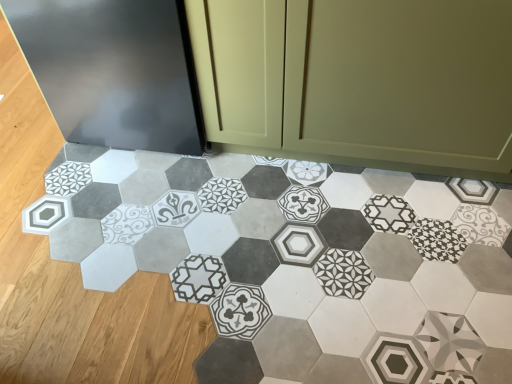
What is the approximate width of patterned ceramic tile at center?

The width of patterned ceramic tile at center is 3.71 feet.

What do you see at coordinates (296, 261) in the screenshot? The image size is (512, 384). I see `patterned ceramic tile at center` at bounding box center [296, 261].

You are a GUI agent. You are given a task and a screenshot of the screen. Output one action in this format:
    pyautogui.click(x=<x>, y=<y>)
    Task: Click on the patterned ceramic tile at center
    
    Given the screenshot: What is the action you would take?
    pyautogui.click(x=296, y=261)

The height and width of the screenshot is (384, 512). What do you see at coordinates (358, 82) in the screenshot?
I see `matte olive green cabinet at center` at bounding box center [358, 82].

The image size is (512, 384). I want to click on matte olive green cabinet at center, so 358,82.

What is the approximate height of matte olive green cabinet at center?

The height of matte olive green cabinet at center is 72.04 centimeters.

Find the location of a particular element. patterned ceramic tile at center is located at coordinates (296, 261).

Consider the image. Which is more to the left, patterned ceramic tile at center or matte olive green cabinet at center?

From the viewer's perspective, patterned ceramic tile at center appears more on the left side.

Which is in front, patterned ceramic tile at center or matte olive green cabinet at center?

patterned ceramic tile at center.

In the scene shown: Which point is more forward, (x=408, y=265) or (x=263, y=125)?

The point (x=408, y=265) is more forward.

From the image's perspective, which one is positioned lower, patterned ceramic tile at center or matte olive green cabinet at center?

patterned ceramic tile at center appears lower in the image.

From a real-world perspective, between patterned ceramic tile at center and matte olive green cabinet at center, who is vertically higher?

matte olive green cabinet at center, from a real-world perspective.

Is patterned ceramic tile at center thinner than matte olive green cabinet at center?

No.

Between patterned ceramic tile at center and matte olive green cabinet at center, which one has less height?

Standing shorter between the two is patterned ceramic tile at center.

Considering the sizes of objects patterned ceramic tile at center and matte olive green cabinet at center in the image provided, who is bigger, patterned ceramic tile at center or matte olive green cabinet at center?

Bigger between the two is matte olive green cabinet at center.

Is patterned ceramic tile at center inside or outside of matte olive green cabinet at center?

patterned ceramic tile at center is located beyond the bounds of matte olive green cabinet at center.

Does patterned ceramic tile at center touch matte olive green cabinet at center?

No, patterned ceramic tile at center is not next to matte olive green cabinet at center.

Is patterned ceramic tile at center positioned with its back to matte olive green cabinet at center?

No.

This screenshot has height=384, width=512. Identify the location of ceramic tile that is below the matte olive green cabinet at center (from the image's perspective). (296, 261).

Visually, is matte olive green cabinet at center positioned to the left or to the right of patterned ceramic tile at center?

Based on their positions, matte olive green cabinet at center is located to the right of patterned ceramic tile at center.

Is the position of matte olive green cabinet at center more distant than that of patterned ceramic tile at center?

Yes, the depth of matte olive green cabinet at center is greater than that of patterned ceramic tile at center.

Is point (354, 70) in front of point (60, 180)?

Yes, it is in front of point (60, 180).

From the image's perspective, is matte olive green cabinet at center above or below patterned ceramic tile at center?

matte olive green cabinet at center is above patterned ceramic tile at center.

From a real-world perspective, is matte olive green cabinet at center on patterned ceramic tile at center?

Yes, from a real-world perspective, matte olive green cabinet at center is on top of patterned ceramic tile at center.

Does matte olive green cabinet at center have a greater width compared to patterned ceramic tile at center?

No, matte olive green cabinet at center is not wider than patterned ceramic tile at center.

Does matte olive green cabinet at center have a lesser height compared to patterned ceramic tile at center?

No.

Is matte olive green cabinet at center smaller than patterned ceramic tile at center?

No.

Is matte olive green cabinet at center situated inside patterned ceramic tile at center or outside?

matte olive green cabinet at center lies outside patterned ceramic tile at center.

Is matte olive green cabinet at center far from patterned ceramic tile at center?

matte olive green cabinet at center is near patterned ceramic tile at center, not far away.

Is matte olive green cabinet at center oriented towards patterned ceramic tile at center?

Yes, matte olive green cabinet at center is oriented towards patterned ceramic tile at center.

Find the location of a particular element. This screenshot has width=512, height=384. cabinetry behind the patterned ceramic tile at center is located at coordinates (358, 82).

You are a GUI agent. You are given a task and a screenshot of the screen. Output one action in this format:
    pyautogui.click(x=<x>, y=<y>)
    Task: Click on the cabinetry lying on the right of patterned ceramic tile at center
    Image resolution: width=512 pixels, height=384 pixels.
    Given the screenshot: What is the action you would take?
    pyautogui.click(x=358, y=82)

You are a GUI agent. You are given a task and a screenshot of the screen. Output one action in this format:
    pyautogui.click(x=<x>, y=<y>)
    Task: Click on the cabinetry above the patterned ceramic tile at center (from a real-world perspective)
    
    Given the screenshot: What is the action you would take?
    pyautogui.click(x=358, y=82)